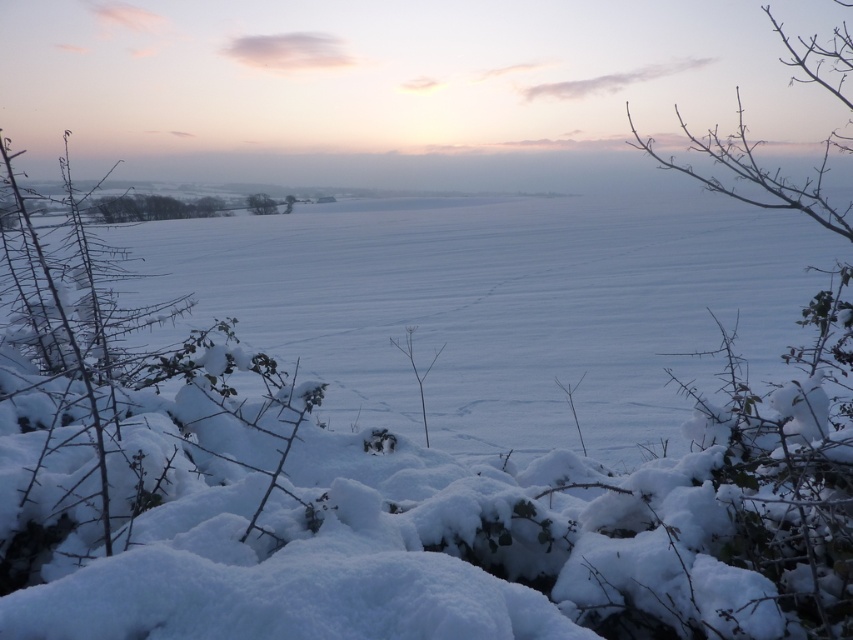
Question: In this image, where is snow-covered thorny bush at left located relative to green leafy tree at center?

Choices:
 (A) right
 (B) left

Answer: (B)

Question: Can you confirm if green leafy trees at upper left is positioned to the right of green leafy tree at center?

Choices:
 (A) yes
 (B) no

Answer: (B)

Question: Which point is farther from the camera taking this photo?

Choices:
 (A) (167, 202)
 (B) (274, 202)
 (C) (164, 381)

Answer: (A)

Question: Estimate the real-world distances between objects in this image. Which object is farther from the snow-covered thorny bush at left?

Choices:
 (A) green leafy trees at upper left
 (B) green leafy tree at center

Answer: (A)

Question: Which is farther from the green leafy tree at center?

Choices:
 (A) snow-covered thorny bush at left
 (B) green leafy trees at upper left

Answer: (A)

Question: Does snow-covered thorny bush at left have a larger size compared to green leafy trees at upper left?

Choices:
 (A) no
 (B) yes

Answer: (B)